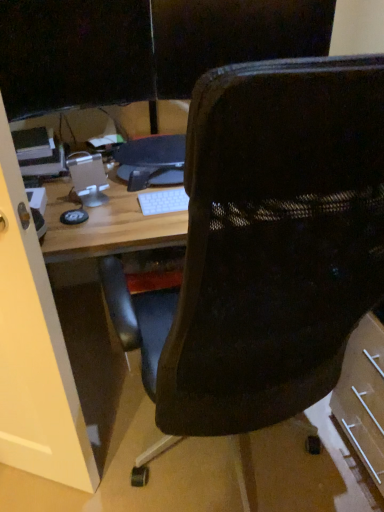
The height and width of the screenshot is (512, 384). What are the coordinates of `free region under black mesh chair at center (from a real-world perspective)` in the screenshot? It's located at (230, 469).